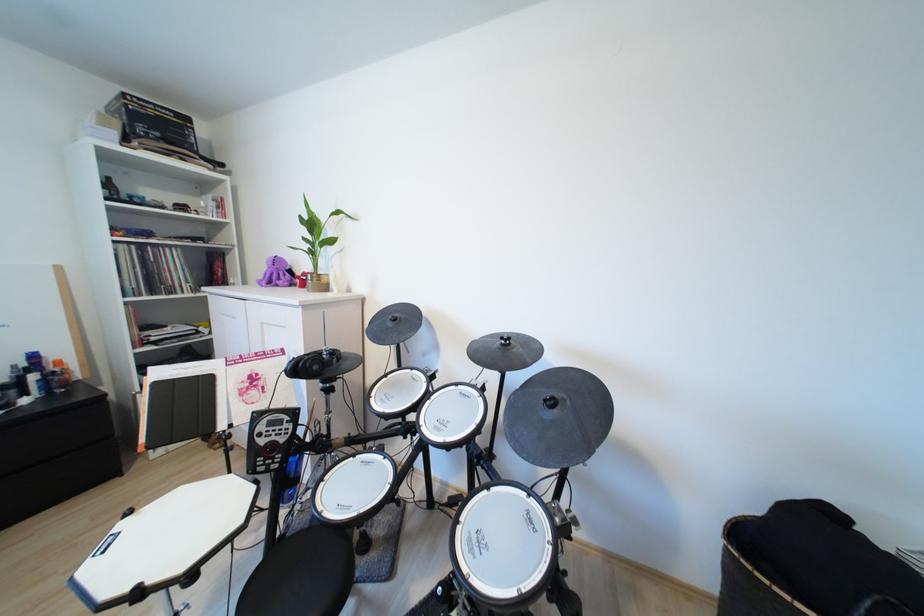
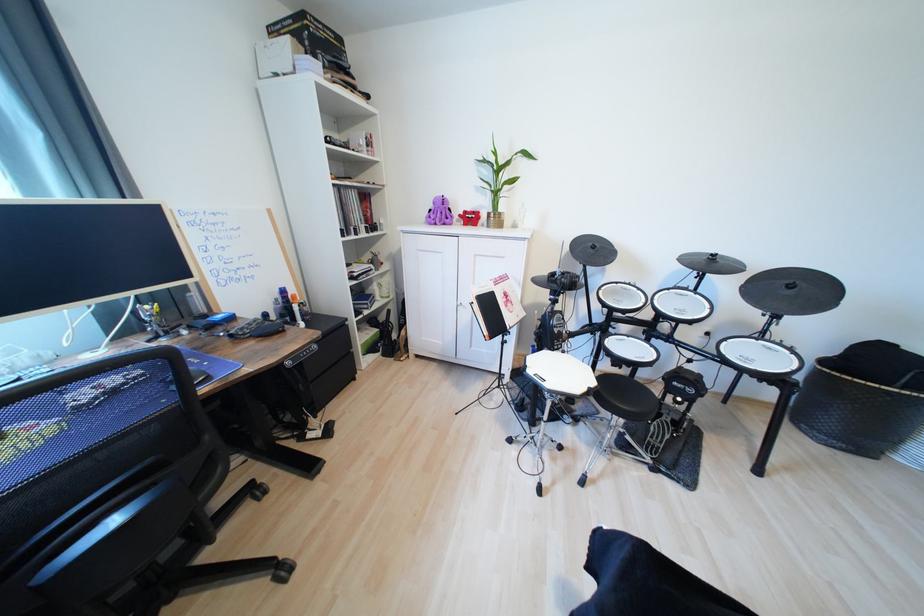
Question: The images are taken continuously from a first-person perspective. In which direction are you moving?

Choices:
 (A) Left
 (B) Right
 (C) Forward
 (D) Backward

Answer: (A)